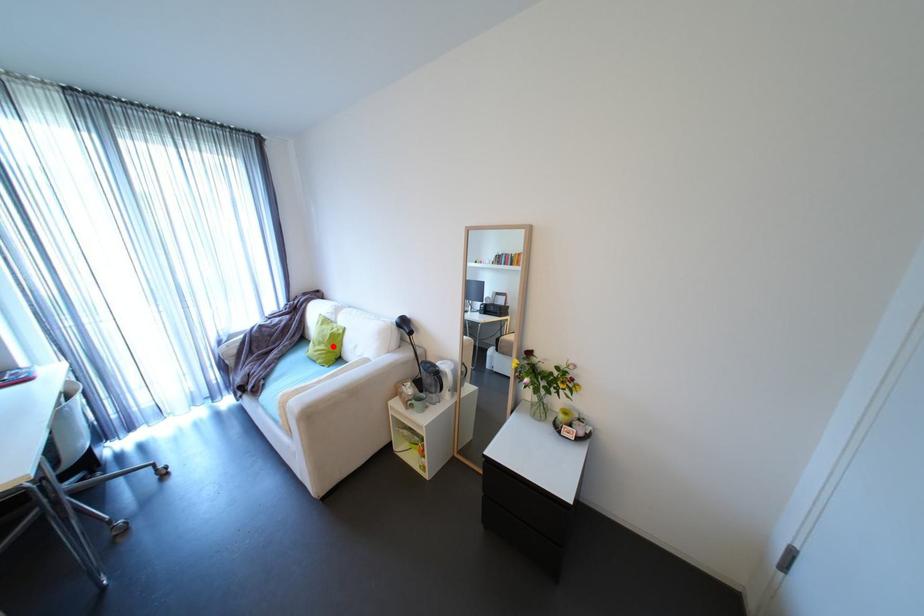
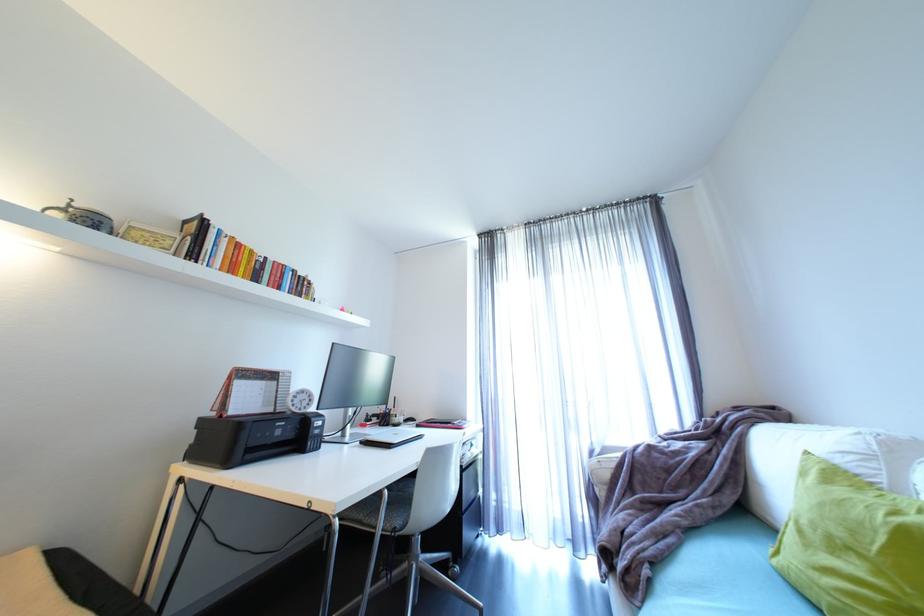
Find the pixel in the second image that matches the highlighted location in the first image.

(885, 573)